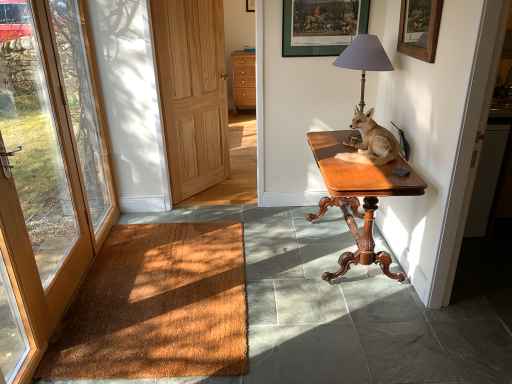
Question: Are light brown fur at table right and light brown wood drawers at center located far from each other?

Choices:
 (A) no
 (B) yes

Answer: (B)

Question: Is light brown fur at table right to the left of light brown wood drawers at center from the viewer's perspective?

Choices:
 (A) no
 (B) yes

Answer: (A)

Question: Is the position of light brown fur at table right less distant than that of light brown wood drawers at center?

Choices:
 (A) no
 (B) yes

Answer: (B)

Question: From a real-world perspective, is light brown fur at table right physically below light brown wood drawers at center?

Choices:
 (A) no
 (B) yes

Answer: (A)

Question: Does light brown fur at table right appear on the right side of light brown wood drawers at center?

Choices:
 (A) yes
 (B) no

Answer: (A)

Question: Relative to brown wood door at left, the 1th door viewed from the left, is brown coir mat at lower left in front or behind?

Choices:
 (A) behind
 (B) front

Answer: (A)

Question: From the image's perspective, relative to brown wood door at left, which appears as the 2th door when viewed from the right, is brown coir mat at lower left above or below?

Choices:
 (A) below
 (B) above

Answer: (A)

Question: Would you say brown coir mat at lower left is inside or outside brown wood door at left, which appears as the 2th door when viewed from the right?

Choices:
 (A) inside
 (B) outside

Answer: (B)

Question: Does point (221, 248) appear closer or farther from the camera than point (38, 175)?

Choices:
 (A) farther
 (B) closer

Answer: (A)

Question: Based on their sizes in the image, would you say metallic gray lampshade at upper right is bigger or smaller than brown wood door at left, which appears as the 2th door when viewed from the right?

Choices:
 (A) big
 (B) small

Answer: (B)

Question: Is point (362, 49) closer or farther from the camera than point (44, 185)?

Choices:
 (A) farther
 (B) closer

Answer: (A)

Question: Is metallic gray lampshade at upper right situated inside brown wood door at left, which appears as the 2th door when viewed from the right, or outside?

Choices:
 (A) inside
 (B) outside

Answer: (B)

Question: Looking at their shapes, would you say metallic gray lampshade at upper right is wider or thinner than brown wood door at left, which appears as the 2th door when viewed from the right?

Choices:
 (A) thin
 (B) wide

Answer: (B)

Question: From a real-world perspective, is green matte picture frame at upper center, the 1th picture frame in the back-to-front sequence, positioned above or below brown wood door at left, which appears as the 2th door when viewed from the right?

Choices:
 (A) below
 (B) above

Answer: (B)

Question: Is green matte picture frame at upper center, placed as the second picture frame when sorted from front to back, in front of or behind brown wood door at left, the 1th door viewed from the left, in the image?

Choices:
 (A) behind
 (B) front

Answer: (A)